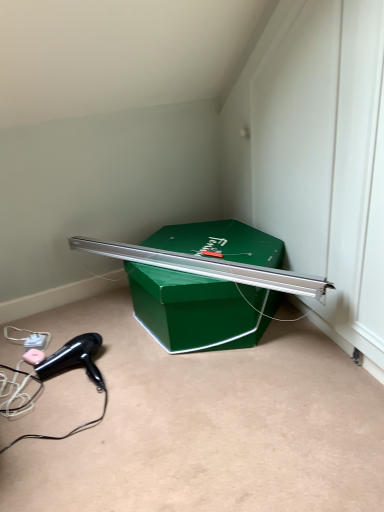
The height and width of the screenshot is (512, 384). Identify the location of empty space that is ontop of green matte box at center (from a real-world perspective). (200, 250).